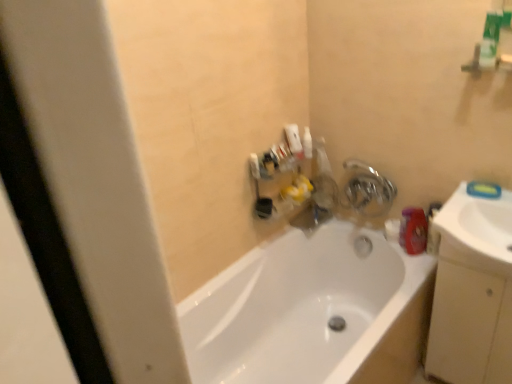
Question: Does matte plastic faucet at upper center come in front of white glossy bathtub at center?

Choices:
 (A) yes
 (B) no

Answer: (B)

Question: From a real-world perspective, is matte plastic faucet at upper center physically below white glossy bathtub at center?

Choices:
 (A) yes
 (B) no

Answer: (B)

Question: Does matte plastic faucet at upper center lie behind white glossy bathtub at center?

Choices:
 (A) yes
 (B) no

Answer: (A)

Question: Is matte plastic faucet at upper center wider than white glossy bathtub at center?

Choices:
 (A) yes
 (B) no

Answer: (B)

Question: From the image's perspective, is matte plastic faucet at upper center under white glossy bathtub at center?

Choices:
 (A) no
 (B) yes

Answer: (A)

Question: From a real-world perspective, is white glossy bathtub at center physically located above or below beige matte cabinet at right?

Choices:
 (A) above
 (B) below

Answer: (B)

Question: Looking at their shapes, would you say white glossy bathtub at center is wider or thinner than beige matte cabinet at right?

Choices:
 (A) thin
 (B) wide

Answer: (B)

Question: Based on their sizes in the image, would you say white glossy bathtub at center is bigger or smaller than beige matte cabinet at right?

Choices:
 (A) big
 (B) small

Answer: (A)

Question: From their relative heights in the image, would you say white glossy bathtub at center is taller or shorter than beige matte cabinet at right?

Choices:
 (A) short
 (B) tall

Answer: (A)

Question: From the image's perspective, relative to metallic silver faucet at upper right, is white glossy sink at right above or below?

Choices:
 (A) below
 (B) above

Answer: (A)

Question: Based on their sizes in the image, would you say white glossy sink at right is bigger or smaller than metallic silver faucet at upper right?

Choices:
 (A) small
 (B) big

Answer: (B)

Question: From a real-world perspective, is white glossy sink at right positioned above or below metallic silver faucet at upper right?

Choices:
 (A) below
 (B) above

Answer: (B)

Question: Would you say white glossy sink at right is inside or outside metallic silver faucet at upper right?

Choices:
 (A) inside
 (B) outside

Answer: (B)

Question: Is white glossy sink at right spatially inside matte plastic faucet at upper center, or outside of it?

Choices:
 (A) inside
 (B) outside

Answer: (B)

Question: Is point (510, 244) positioned closer to the camera than point (288, 221)?

Choices:
 (A) closer
 (B) farther

Answer: (A)